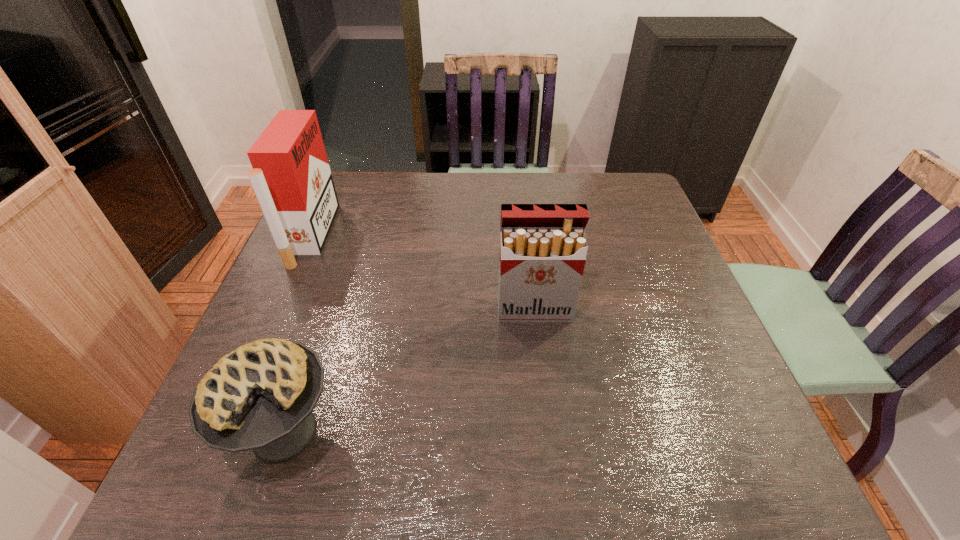
You are a GUI agent. You are given a task and a screenshot of the screen. Output one action in this format:
    pyautogui.click(x=<x>, y=<y>)
    Task: Click on the cigarette case situated at the left edge
    The width and height of the screenshot is (960, 540).
    Given the screenshot: What is the action you would take?
    click(x=291, y=177)

The width and height of the screenshot is (960, 540). Find the location of `pie that is at the left edge`. pie that is at the left edge is located at coordinates (261, 396).

Where is `object that is at the far left corner`? The width and height of the screenshot is (960, 540). object that is at the far left corner is located at coordinates (291, 177).

The width and height of the screenshot is (960, 540). Identify the location of object that is positioned at the near left corner. (261, 396).

You are a GUI agent. You are given a task and a screenshot of the screen. Output one action in this format:
    pyautogui.click(x=<x>, y=<y>)
    Task: Click on the free space at the far edge of the desktop
    Image resolution: width=960 pixels, height=540 pixels.
    Given the screenshot: What is the action you would take?
    pyautogui.click(x=418, y=174)

Identify the location of vacant space at the near edge of the desktop. (529, 482).

In the image, there is a desktop. What are the coordinates of `vacant space at the left edge` in the screenshot? It's located at (282, 282).

This screenshot has width=960, height=540. I want to click on vacant space at the right edge of the desktop, so click(706, 358).

In the image, there is a desktop. At what (x,y) coordinates should I click in order to perform the action: click on vacant area at the far left corner. Please return your answer as a coordinate pair (x, y). Looking at the image, I should click on pos(335,174).

In the image, there is a desktop. Identify the location of vacant space at the near left corner. The height and width of the screenshot is (540, 960). (264, 485).